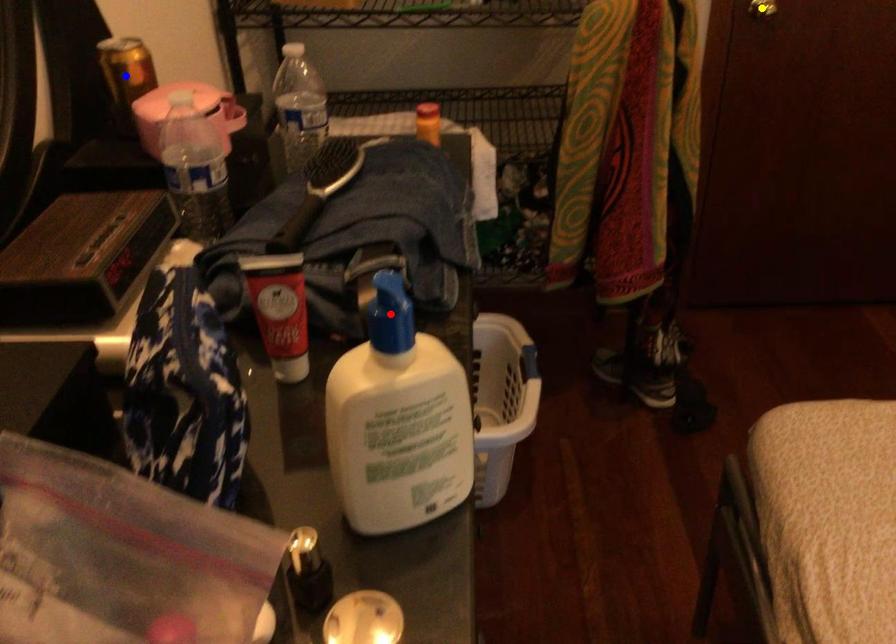
Order these from nearest to farthest:
yellow point
red point
blue point

red point, blue point, yellow point